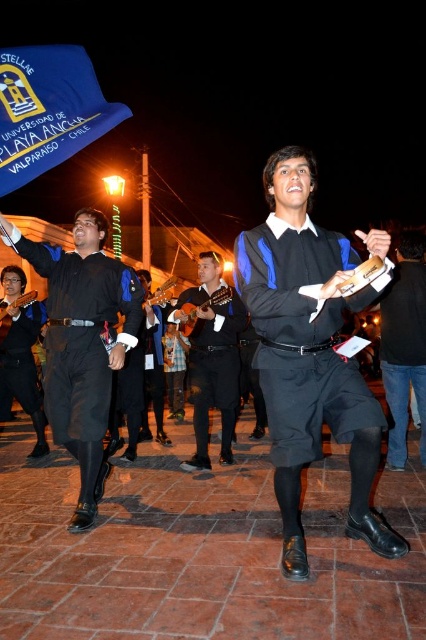
Is point (77, 515) positioned in front of point (16, 332)?

Yes, it is.

Identify the location of matte black shirt at left. The image size is (426, 640). (81, 342).

Can you confirm if black matte shorts at center is bigger than matte black guitar at left?

Yes.

Can you confirm if black matte shorts at center is positioned to the left of matte black guitar at left?

Incorrect, black matte shorts at center is not on the left side of matte black guitar at left.

Is point (310, 419) closer to camera compared to point (39, 403)?

Yes.

The height and width of the screenshot is (640, 426). What are the coordinates of `black matte shorts at center` in the screenshot? It's located at [x=308, y=353].

Is black leather guitar at center closer to camera compared to matte black guitar at left?

Yes.

Is black leather guitar at center above matte black guitar at left?

Correct, black leather guitar at center is located above matte black guitar at left.

The height and width of the screenshot is (640, 426). I want to click on black leather guitar at center, so click(213, 355).